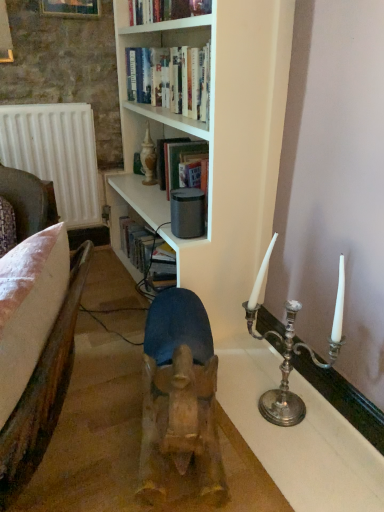
Locate an element on the screen. The height and width of the screenshot is (512, 384). free space on the front side of silver metallic candle holder at right is located at coordinates (295, 468).